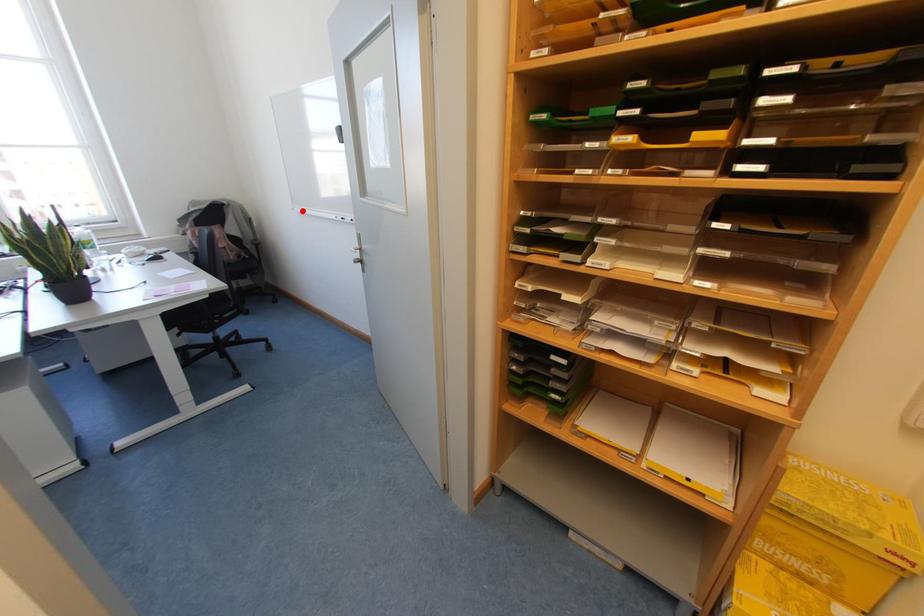
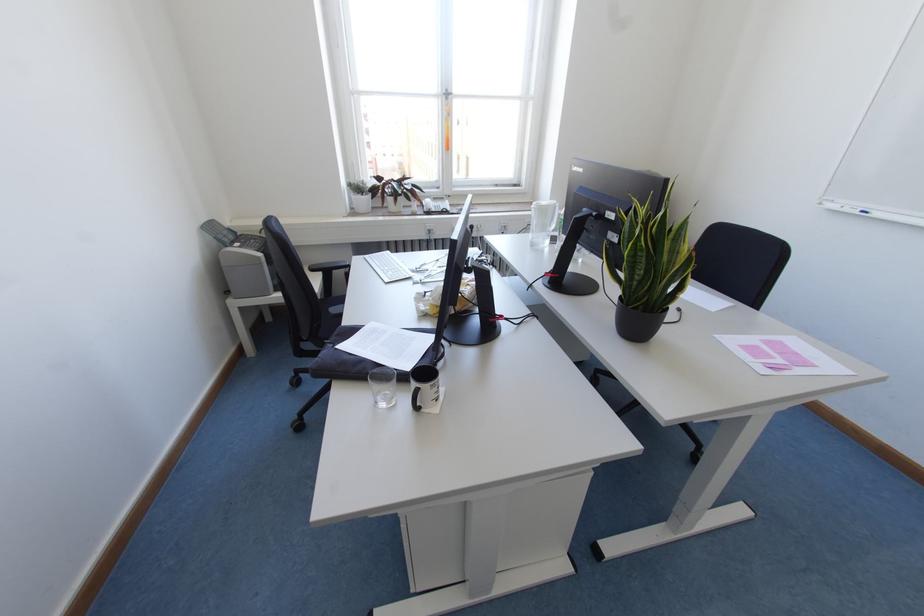
Question: I am providing you with two images of the same scene from different viewpoints. A red point is marked on the first image. At the location where the point appears in image 1, is it still visible in image 2?

Choices:
 (A) Yes
 (B) No

Answer: (A)